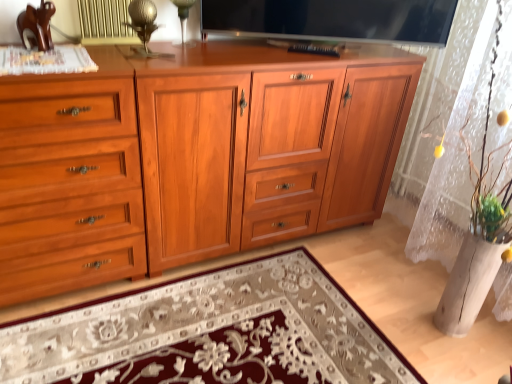
Question: Is matte wood cupboard at left further to the viewer compared to flat screen tv at upper center?

Choices:
 (A) yes
 (B) no

Answer: (B)

Question: Is matte wood cupboard at left in front of flat screen tv at upper center?

Choices:
 (A) no
 (B) yes

Answer: (B)

Question: From the image's perspective, is matte wood cupboard at left beneath flat screen tv at upper center?

Choices:
 (A) no
 (B) yes

Answer: (B)

Question: Is the surface of matte wood cupboard at left in direct contact with flat screen tv at upper center?

Choices:
 (A) yes
 (B) no

Answer: (B)

Question: Can flat screen tv at upper center be found inside matte wood cupboard at left?

Choices:
 (A) no
 (B) yes

Answer: (A)

Question: In terms of size, does flat screen tv at upper center appear bigger or smaller than matte wood cupboard at left?

Choices:
 (A) small
 (B) big

Answer: (A)

Question: From a real-world perspective, relative to matte wood cupboard at left, is flat screen tv at upper center vertically above or below?

Choices:
 (A) above
 (B) below

Answer: (A)

Question: Which is correct: flat screen tv at upper center is inside matte wood cupboard at left, or outside of it?

Choices:
 (A) outside
 (B) inside

Answer: (A)

Question: Considering their positions, is flat screen tv at upper center located in front of or behind matte wood cupboard at left?

Choices:
 (A) front
 (B) behind

Answer: (B)

Question: In the image, is shiny wood cabinet at center on the left side or the right side of matte wood cupboard at left?

Choices:
 (A) left
 (B) right

Answer: (B)

Question: From a real-world perspective, is shiny wood cabinet at center physically located above or below matte wood cupboard at left?

Choices:
 (A) above
 (B) below

Answer: (B)

Question: Is shiny wood cabinet at center wider or thinner than matte wood cupboard at left?

Choices:
 (A) wide
 (B) thin

Answer: (B)

Question: Is point (113, 86) closer or farther from the camera than point (103, 117)?

Choices:
 (A) farther
 (B) closer

Answer: (B)

Question: Is shiny wood cabinet at center to the left or to the right of floral carpet at center in the image?

Choices:
 (A) right
 (B) left

Answer: (A)

Question: From the image's perspective, is shiny wood cabinet at center located above or below floral carpet at center?

Choices:
 (A) above
 (B) below

Answer: (A)